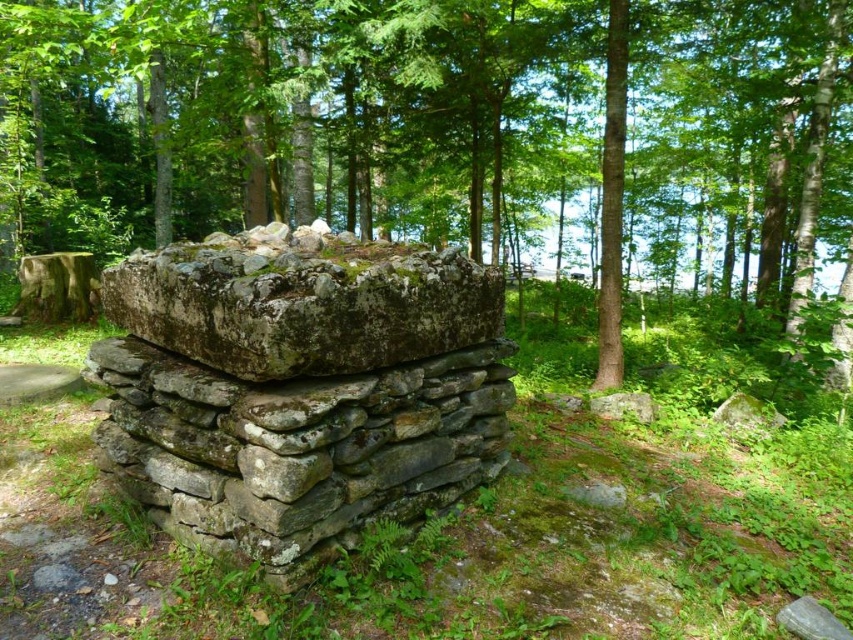
You are a hiker navigating through the forest and come across the gray stone wall at center and the green mossy stone at center. Which one is located to the right when facing the structure?

The gray stone wall at center is positioned on the right side of green mossy stone at center, so it is located to the right when facing the structure.

You are a hiker who wants to cross between the green rough bark tree at center and the gray stone wall at center. The path between them is narrow. If your backpack is 0.9 meters wide, can you pass through the space between them without removing your backpack?

The distance between the green rough bark tree at center and the gray stone wall at center is 8.91 meters. Since your backpack is only 0.9 meters wide, you have plenty of space to pass through the narrow path between them without needing to remove your backpack.

You are an architect designing a new garden and want to incorporate both the green rough bark tree at center and the gray stone wall at center. Based on their widths, which one should you place closer to the entrance to ensure the entrance doesn

The green rough bark tree at center is wider than the gray stone wall at center. To ensure the entrance appears balanced, place the wider green rough bark tree at center closer to the entrance so it draws attention and anchors the space.